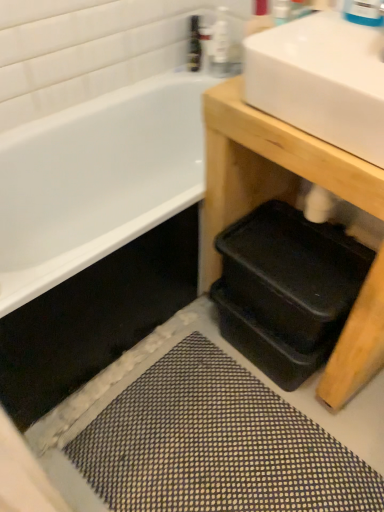
Question: Is black plastic trays at lower right taller or shorter than translucent plastic bottle at upper center, which is counted as the first toiletry, starting from the left?

Choices:
 (A) tall
 (B) short

Answer: (A)

Question: Considering the relative positions of black plastic trays at lower right and translucent plastic bottle at upper center, which ranks as the second toiletry in right-to-left order, in the image provided, is black plastic trays at lower right to the left or to the right of translucent plastic bottle at upper center, which ranks as the second toiletry in right-to-left order,?

Choices:
 (A) left
 (B) right

Answer: (B)

Question: Based on their relative distances, which object is farther from the blue glossy faucet at upper right?

Choices:
 (A) black plastic trays at lower right
 (B) translucent plastic bottle at upper center, which is counted as the first toiletry, starting from the left
 (C) white glossy sink at upper right
 (D) textured gray bath mat at lower center
 (E) clear plastic bottle at upper center, which is the second toiletry from left to right

Answer: (D)

Question: Which is farther from the blue glossy faucet at upper right?

Choices:
 (A) translucent plastic bottle at upper center, which is counted as the first toiletry, starting from the left
 (B) clear plastic bottle at upper center, which is the second toiletry from left to right
 (C) white glossy sink at upper right
 (D) textured gray bath mat at lower center
 (E) black plastic trays at lower right

Answer: (D)